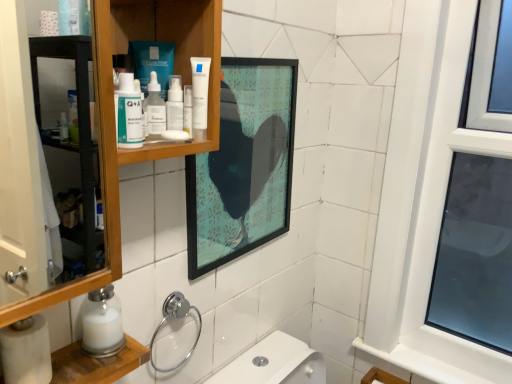
Question: From the image's perspective, does white matte tube at upper center appear lower than wooden cabinet at upper left?

Choices:
 (A) no
 (B) yes

Answer: (A)

Question: Is white matte tube at upper center to the right of wooden cabinet at upper left from the viewer's perspective?

Choices:
 (A) no
 (B) yes

Answer: (B)

Question: Can you confirm if white matte tube at upper center is smaller than wooden cabinet at upper left?

Choices:
 (A) no
 (B) yes

Answer: (B)

Question: Is there a large distance between white matte tube at upper center and wooden cabinet at upper left?

Choices:
 (A) yes
 (B) no

Answer: (B)

Question: Is white matte tube at upper center thinner than wooden cabinet at upper left?

Choices:
 (A) no
 (B) yes

Answer: (B)

Question: Which is correct: chrome/metallic towel ring at lower center is inside matte glass picture frame at upper center, or outside of it?

Choices:
 (A) inside
 (B) outside

Answer: (B)

Question: In the image, is chrome/metallic towel ring at lower center on the left side or the right side of matte glass picture frame at upper center?

Choices:
 (A) left
 (B) right

Answer: (A)

Question: From the image's perspective, is chrome/metallic towel ring at lower center located above or below matte glass picture frame at upper center?

Choices:
 (A) below
 (B) above

Answer: (A)

Question: From their relative heights in the image, would you say chrome/metallic towel ring at lower center is taller or shorter than matte glass picture frame at upper center?

Choices:
 (A) short
 (B) tall

Answer: (A)

Question: From a real-world perspective, relative to wooden cabinet at upper left, is matte plastic q+a bottle at upper left vertically above or below?

Choices:
 (A) below
 (B) above

Answer: (B)

Question: Considering the positions of point (144, 119) and point (117, 375), is point (144, 119) closer or farther from the camera than point (117, 375)?

Choices:
 (A) closer
 (B) farther

Answer: (A)

Question: Is matte plastic q+a bottle at upper left situated inside wooden cabinet at upper left or outside?

Choices:
 (A) inside
 (B) outside

Answer: (A)

Question: In the image, is matte plastic q+a bottle at upper left positioned in front of or behind wooden cabinet at upper left?

Choices:
 (A) front
 (B) behind

Answer: (B)

Question: Considering the positions of white matte tube at upper center and chrome/metallic towel ring at lower center in the image, is white matte tube at upper center bigger or smaller than chrome/metallic towel ring at lower center?

Choices:
 (A) small
 (B) big

Answer: (A)

Question: Visually, is white matte tube at upper center positioned to the left or to the right of chrome/metallic towel ring at lower center?

Choices:
 (A) right
 (B) left

Answer: (A)